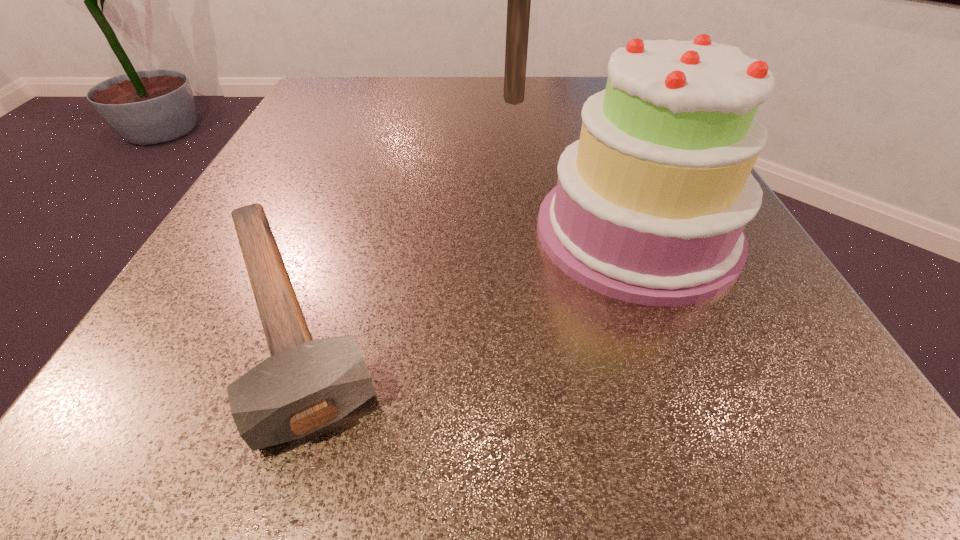
Locate an element on the screen. The image size is (960, 540). object that is at the left edge is located at coordinates (305, 385).

Locate an element on the screen. This screenshot has height=540, width=960. object at the right edge is located at coordinates (650, 205).

This screenshot has width=960, height=540. I want to click on object that is at the near left corner, so click(305, 385).

I want to click on free space at the far edge of the desktop, so click(577, 111).

The height and width of the screenshot is (540, 960). I want to click on vacant space at the near edge of the desktop, so click(563, 379).

Find the location of a particular element. This screenshot has width=960, height=540. vacant space at the left edge of the desktop is located at coordinates (216, 350).

In the image, there is a desktop. Where is `free space at the right edge`? free space at the right edge is located at coordinates (803, 346).

Locate an element on the screen. This screenshot has height=540, width=960. vacant space at the near left corner of the desktop is located at coordinates (122, 438).

This screenshot has height=540, width=960. What are the coordinates of `vacant space at the near right corner of the desktop` in the screenshot? It's located at (797, 397).

Where is `free space between the tallest object and the left mallet`? free space between the tallest object and the left mallet is located at coordinates (403, 207).